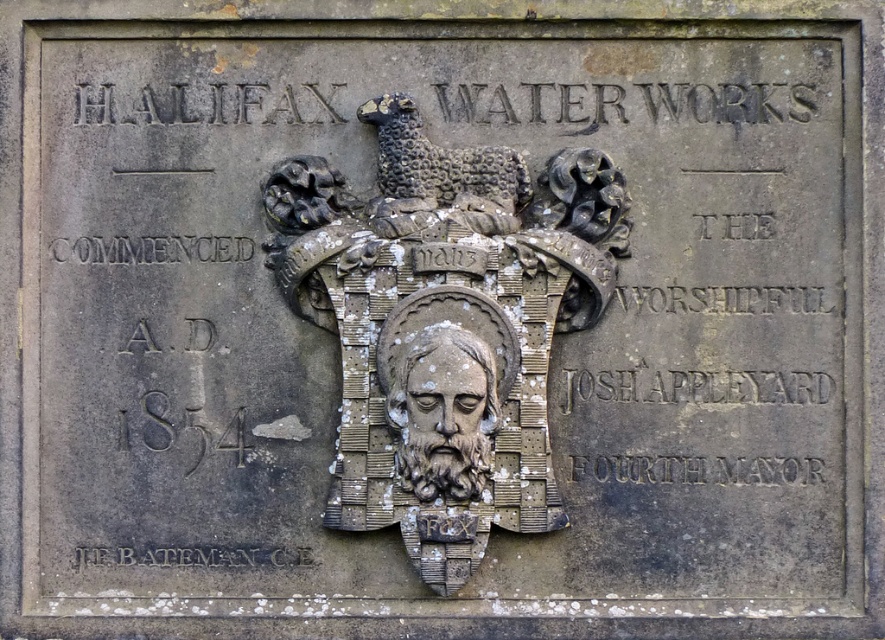
Does black stone engraving at center have a greater height compared to gray stone face at center?

No.

How far apart are black stone engraving at center and gray stone face at center?

A distance of 3.61 feet exists between black stone engraving at center and gray stone face at center.

At what (x,y) coordinates should I click in order to perform the action: click on black stone engraving at center. Please return your answer as a coordinate pair (x, y). The image size is (885, 640). Looking at the image, I should click on (694, 387).

Who is taller, rusty metal shield at center or black stone text at upper left?

With more height is rusty metal shield at center.

Which of these two, rusty metal shield at center or black stone text at upper left, stands shorter?

black stone text at upper left

Is point (451, 200) farther from viewer compared to point (181, 248)?

No.

This screenshot has width=885, height=640. I want to click on rusty metal shield at center, so click(x=445, y=324).

This screenshot has height=640, width=885. What do you see at coordinates (445, 324) in the screenshot? I see `rusty metal shield at center` at bounding box center [445, 324].

Is point (408, 432) less distant than point (168, 561)?

Yes, point (408, 432) is closer to viewer.

I want to click on rusty metal shield at center, so click(445, 324).